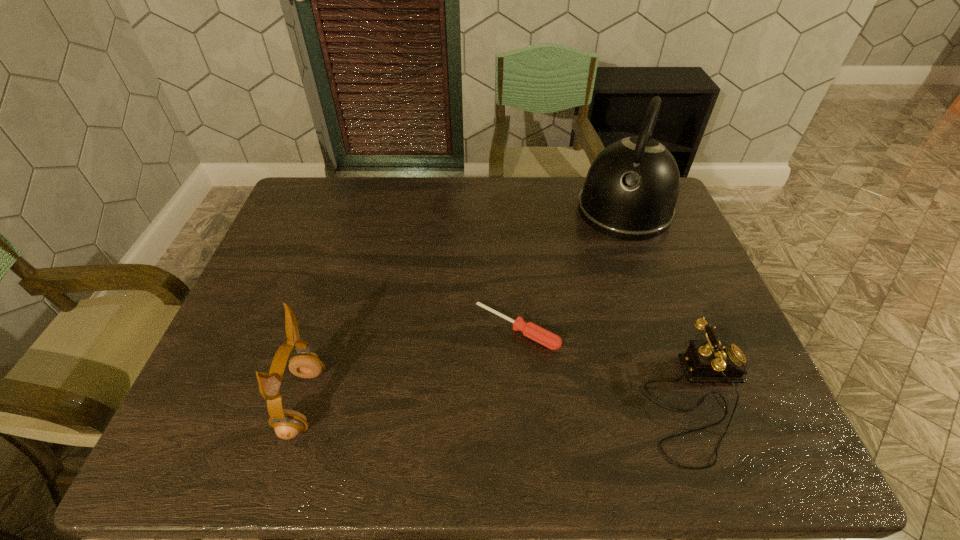
In order to click on object situated at the near right corner in this screenshot , I will do `click(705, 361)`.

Image resolution: width=960 pixels, height=540 pixels. In the image, there is a desktop. What are the coordinates of `vacant space at the far edge` in the screenshot? It's located at (472, 214).

In the image, there is a desktop. What are the coordinates of `blank space at the near edge` in the screenshot? It's located at (585, 384).

Locate an element on the screen. vacant space at the left edge of the desktop is located at coordinates [x=245, y=358].

The image size is (960, 540). In order to click on vacant space at the right edge in this screenshot , I will do `click(717, 309)`.

Find the location of a particular element. vacant space at the far left corner is located at coordinates (337, 185).

In the image, there is a desktop. Where is `vacant region at the near left corner`? vacant region at the near left corner is located at coordinates (252, 387).

Find the location of `vacant region between the leftmost object and the farthest object`. vacant region between the leftmost object and the farthest object is located at coordinates (464, 306).

This screenshot has width=960, height=540. Find the location of `blank region between the second object from left to right and the third tallest object`. blank region between the second object from left to right and the third tallest object is located at coordinates (608, 365).

The image size is (960, 540). I want to click on free space that is in between the second shortest object and the tallest object, so click(x=661, y=306).